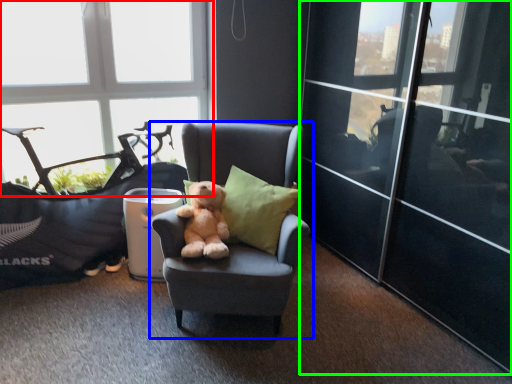
Question: Estimate the real-world distances between objects in this image. Which object is farther from window (highlighted by a red box), chair (highlighted by a blue box) or glass door (highlighted by a green box)?

Choices:
 (A) chair
 (B) glass door

Answer: (B)